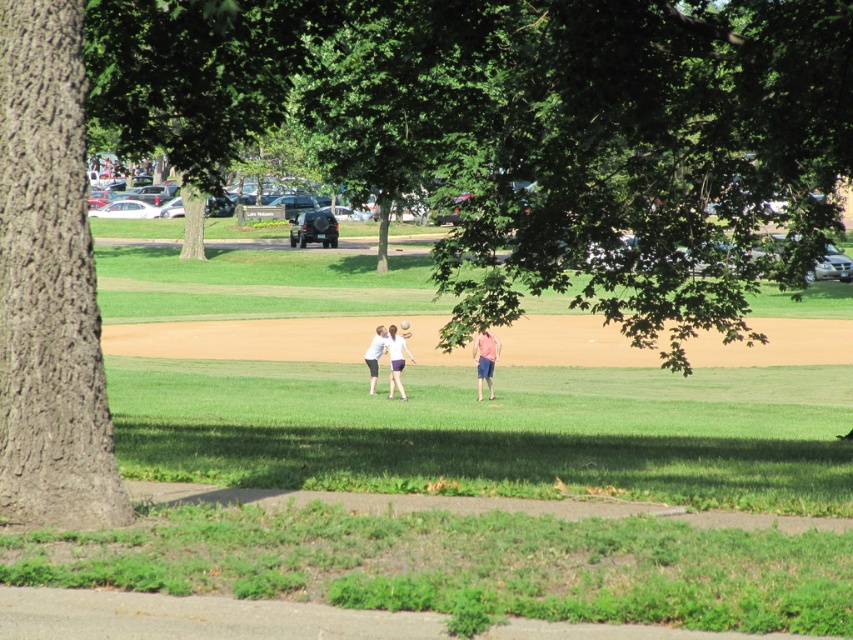
You are trying to decide whether to place a small garden statue between the smooth brown bark at left and the white matte shirt at center. Based on their thickness, can you determine which side would be more stable for the statue?

The smooth brown bark at left is thinner than the white matte shirt at center, so placing the statue closer to the white matte shirt at center would provide a more stable base due to its greater thickness.